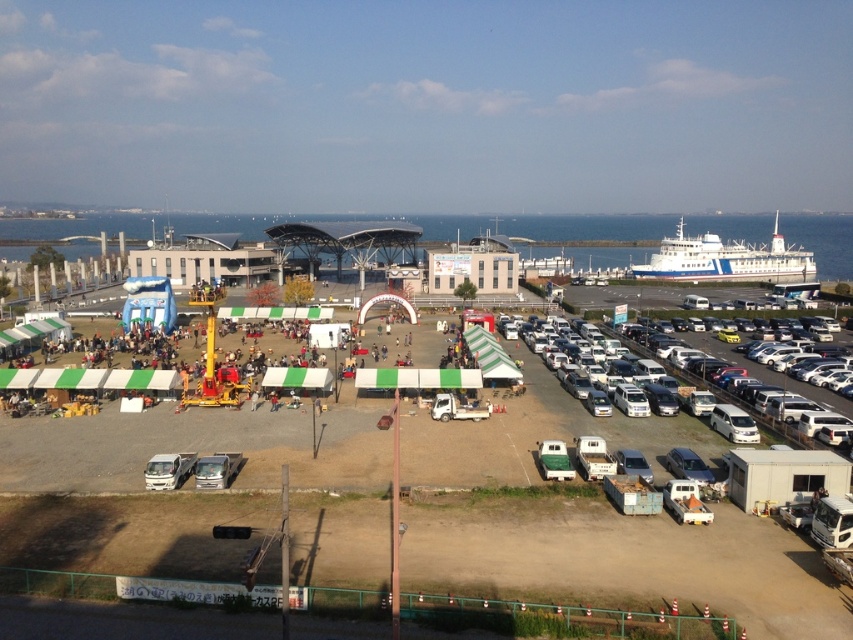
Question: Estimate the real-world distances between objects in this image. Which object is farther from the metallic silver car at lower right?

Choices:
 (A) blue polished ship at right
 (B) metallic silver van at center

Answer: (A)

Question: Which object is positioned farthest from the blue polished ship at right?

Choices:
 (A) white matte truck at center
 (B) white matte truck at lower left
 (C) silver metallic van at lower left
 (D) white matte minivan at right

Answer: (B)

Question: Is white matte truck at center to the right of green matte van at center from the viewer's perspective?

Choices:
 (A) yes
 (B) no

Answer: (B)

Question: Does blue polished ship at right appear on the left side of metallic silver van at center?

Choices:
 (A) yes
 (B) no

Answer: (B)

Question: Estimate the real-world distances between objects in this image. Which object is closer to the blue polished ship at right?

Choices:
 (A) metallic silver van at center
 (B) silver metallic van at lower left
 (C) white matte truck at center
 (D) green matte van at center

Answer: (C)

Question: Does white matte truck at center have a greater width compared to metallic silver car at lower right?

Choices:
 (A) no
 (B) yes

Answer: (B)